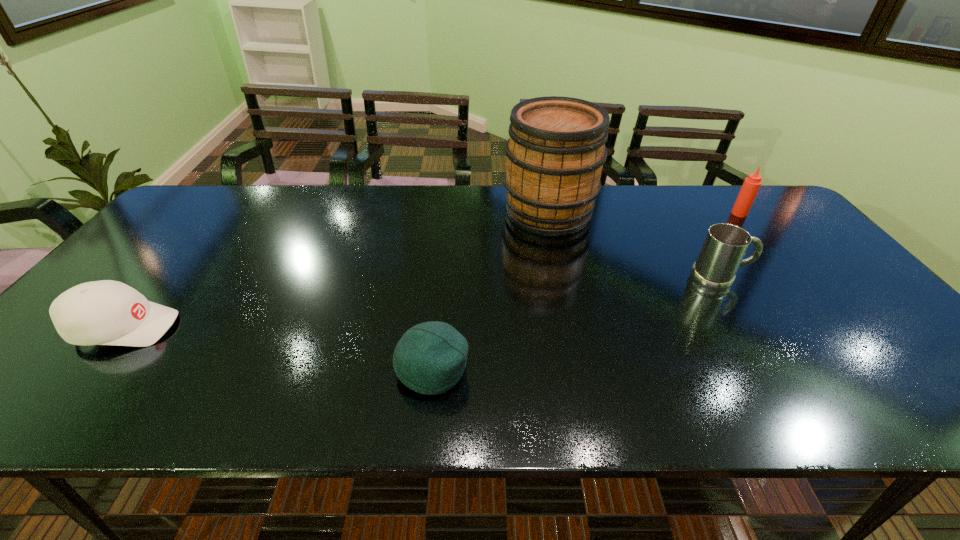
The width and height of the screenshot is (960, 540). What are the coordinates of `empty location between the second object from left to right and the rightmost object` in the screenshot? It's located at (586, 291).

At what (x,y) coordinates should I click in order to perform the action: click on vacant space in between the third object from left to right and the leftmost object. Please return your answer as a coordinate pair (x, y). The width and height of the screenshot is (960, 540). Looking at the image, I should click on (336, 269).

This screenshot has width=960, height=540. I want to click on object that is the fourth closest to the beanie, so click(x=751, y=185).

Locate which object ranks second in proximity to the third object from right to left. Please provide its 2D coordinates. Your answer should be formatted as a tuple, i.e. [(x, y)], where the tuple contains the x and y coordinates of a point satisfying the conditions above.

[(430, 358)]

The image size is (960, 540). Find the location of `blank area in the image that satisfies the following two spatial constraints: 1. on the front side of the tallest object; 2. on the front-facing side of the baseball cap`. blank area in the image that satisfies the following two spatial constraints: 1. on the front side of the tallest object; 2. on the front-facing side of the baseball cap is located at coordinates (573, 328).

Locate an element on the screen. Image resolution: width=960 pixels, height=540 pixels. free space that satisfies the following two spatial constraints: 1. on the front-facing side of the baseball cap; 2. on the left side of the beanie is located at coordinates (91, 368).